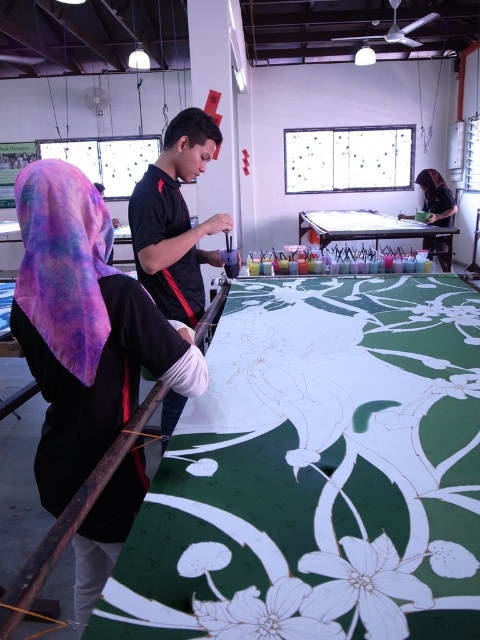
You are a visitor in the workshop and want to take a photo of the multicolored fabric shawl at left without moving any objects. Where should you position yourself to capture the entire shawl in the frame?

To capture the entire multicolored fabric shawl at left in your photo, position yourself directly in front of it, ensuring you are aligned with its central point at coordinates approximately 0.411 on the x and 0.133 on the y axis.

You are a visitor in the workshop and want to take a photo of the multicolored fabric shawl at left and the black jersey at center. Which object should you focus on first if you want to capture both in the same frame without moving the camera?

The multicolored fabric shawl at left is positioned under the black jersey at center, so you should focus on the black jersey at center first to ensure both are in focus since it is closer to the camera.